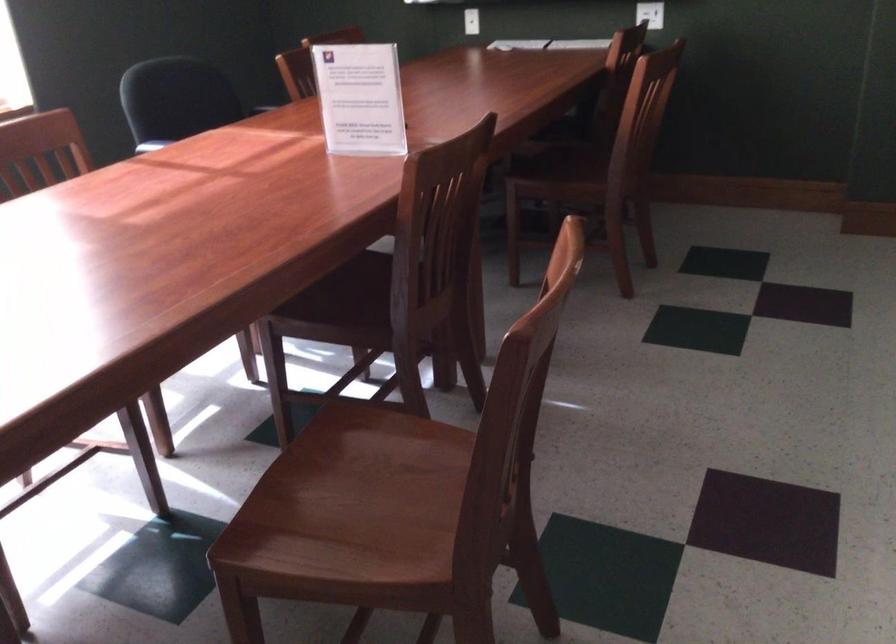
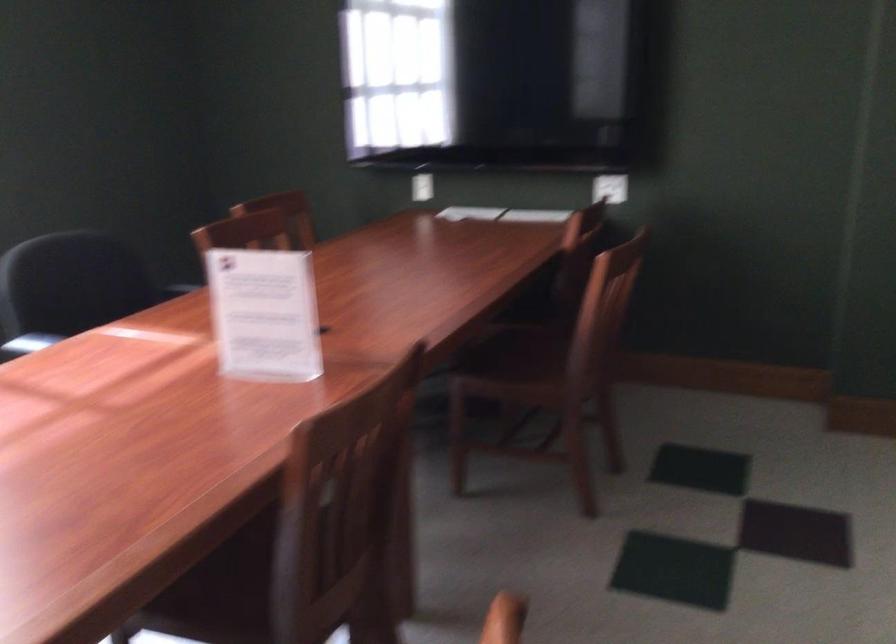
Question: What movement of the cameraman would produce the second image?

Choices:
 (A) Left
 (B) Right
 (C) Forward
 (D) Backward

Answer: (C)